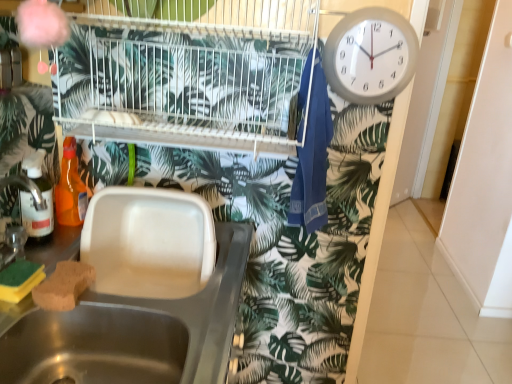
Question: Is green sponge at lower left, the first food when ordered from left to right, at the back of translucent orange bottle at left, marked as the 1th bottle in a back-to-front arrangement?

Choices:
 (A) yes
 (B) no

Answer: (B)

Question: Are translucent orange bottle at left, which is the 2th bottle in front-to-back order, and green sponge at lower left, arranged as the second food when viewed from the right, far apart?

Choices:
 (A) yes
 (B) no

Answer: (B)

Question: Considering the relative sizes of translucent orange bottle at left, which is the 2th bottle in front-to-back order, and green sponge at lower left, the first food when ordered from left to right, in the image provided, is translucent orange bottle at left, which is the 2th bottle in front-to-back order, shorter than green sponge at lower left, the first food when ordered from left to right,?

Choices:
 (A) yes
 (B) no

Answer: (B)

Question: From a real-world perspective, is translucent orange bottle at left, which is the 2th bottle in front-to-back order, below green sponge at lower left, the first food when ordered from left to right?

Choices:
 (A) no
 (B) yes

Answer: (A)

Question: Can you confirm if translucent orange bottle at left, marked as the 1th bottle in a back-to-front arrangement, is positioned to the right of green sponge at lower left, arranged as the second food when viewed from the right?

Choices:
 (A) no
 (B) yes

Answer: (A)

Question: Would you say white wire bird cage at upper center is inside or outside brown sponge at sink left, which ranks as the 2th food in left-to-right order?

Choices:
 (A) outside
 (B) inside

Answer: (A)

Question: From a real-world perspective, is white wire bird cage at upper center positioned above or below brown sponge at sink left, which ranks as the 2th food in left-to-right order?

Choices:
 (A) above
 (B) below

Answer: (A)

Question: From the image's perspective, is white wire bird cage at upper center above or below brown sponge at sink left, which is counted as the first food, starting from the right?

Choices:
 (A) above
 (B) below

Answer: (A)

Question: Is white wire bird cage at upper center bigger or smaller than brown sponge at sink left, which ranks as the 2th food in left-to-right order?

Choices:
 (A) small
 (B) big

Answer: (B)

Question: Is white glossy screen door at right to the left or to the right of blue fabric laundry at upper right in the image?

Choices:
 (A) left
 (B) right

Answer: (B)

Question: From a real-world perspective, is white glossy screen door at right physically located above or below blue fabric laundry at upper right?

Choices:
 (A) below
 (B) above

Answer: (A)

Question: Relative to blue fabric laundry at upper right, is white glossy screen door at right in front or behind?

Choices:
 (A) front
 (B) behind

Answer: (B)

Question: In terms of height, does white glossy screen door at right look taller or shorter compared to blue fabric laundry at upper right?

Choices:
 (A) short
 (B) tall

Answer: (B)

Question: From a real-world perspective, relative to white plastic clock at upper right, is blue fabric laundry at upper right vertically above or below?

Choices:
 (A) below
 (B) above

Answer: (A)

Question: Is blue fabric laundry at upper right wider or thinner than white plastic clock at upper right?

Choices:
 (A) thin
 (B) wide

Answer: (B)